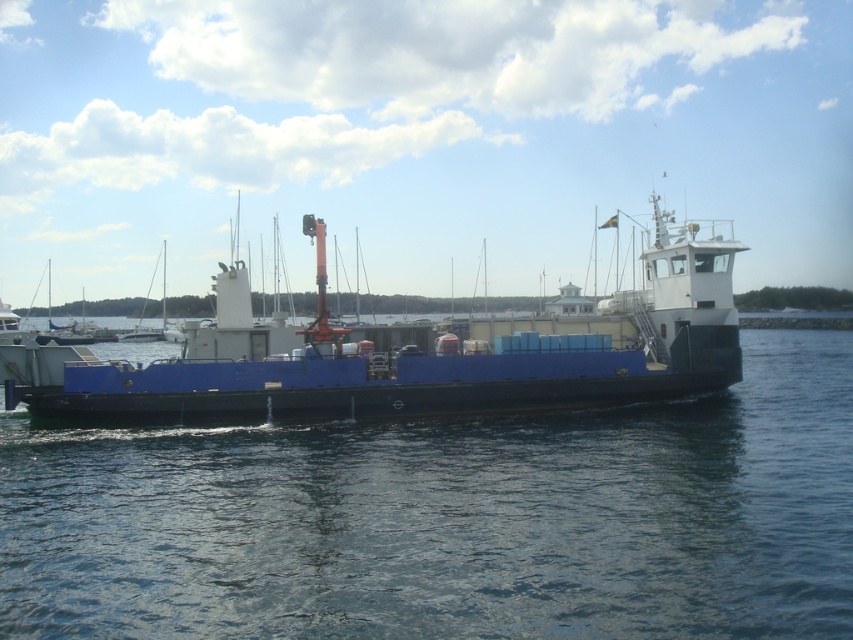
Is blue water at center above blue matte boat at center?

No.

Does blue water at center appear under blue matte boat at center?

Yes, blue water at center is below blue matte boat at center.

At what (x,y) coordinates should I click in order to perform the action: click on blue water at center. Please return your answer as a coordinate pair (x, y). This screenshot has width=853, height=640. Looking at the image, I should click on (450, 518).